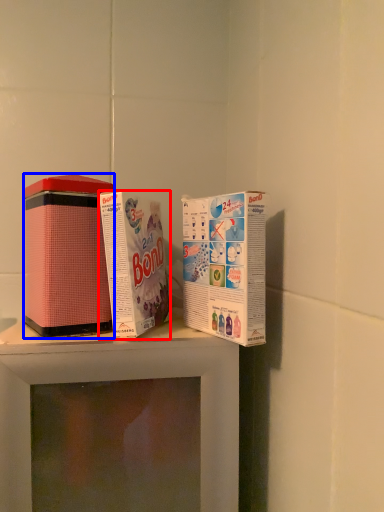
Question: Which object appears closest to the camera in this image, product (highlighted by a red box) or product (highlighted by a blue box)?

Choices:
 (A) product
 (B) product

Answer: (A)